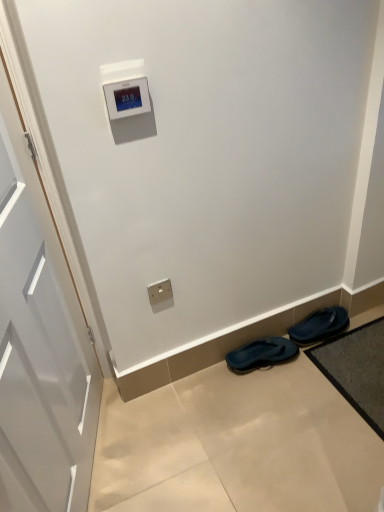
You are a GUI agent. You are given a task and a screenshot of the screen. Output one action in this format:
    pyautogui.click(x=<x>, y=<y>)
    Task: Click on the vacant space situated above beige tile floor at lower center (from a real-world perspective)
    The image size is (384, 512).
    Given the screenshot: What is the action you would take?
    pyautogui.click(x=251, y=421)